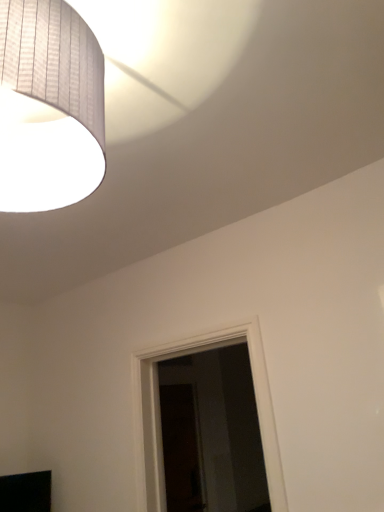
Question: Which is correct: white paper lampshade at upper left is inside black matte tv at lower left, or outside of it?

Choices:
 (A) inside
 (B) outside

Answer: (B)

Question: Relative to black matte tv at lower left, is white paper lampshade at upper left in front or behind?

Choices:
 (A) front
 (B) behind

Answer: (A)

Question: Is point (0, 57) closer or farther from the camera than point (33, 505)?

Choices:
 (A) closer
 (B) farther

Answer: (A)

Question: Looking at their shapes, would you say black matte tv at lower left is wider or thinner than white paper lampshade at upper left?

Choices:
 (A) wide
 (B) thin

Answer: (B)

Question: Looking at the image, does black matte tv at lower left seem bigger or smaller compared to white paper lampshade at upper left?

Choices:
 (A) big
 (B) small

Answer: (B)

Question: Visually, is black matte tv at lower left positioned to the left or to the right of white paper lampshade at upper left?

Choices:
 (A) right
 (B) left

Answer: (B)

Question: From a real-world perspective, is black matte tv at lower left positioned above or below white paper lampshade at upper left?

Choices:
 (A) below
 (B) above

Answer: (A)